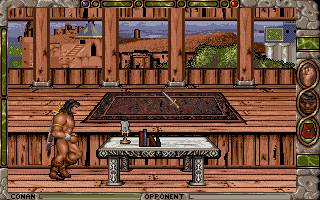
Identify the location of books. (141, 140), (143, 140), (148, 141).